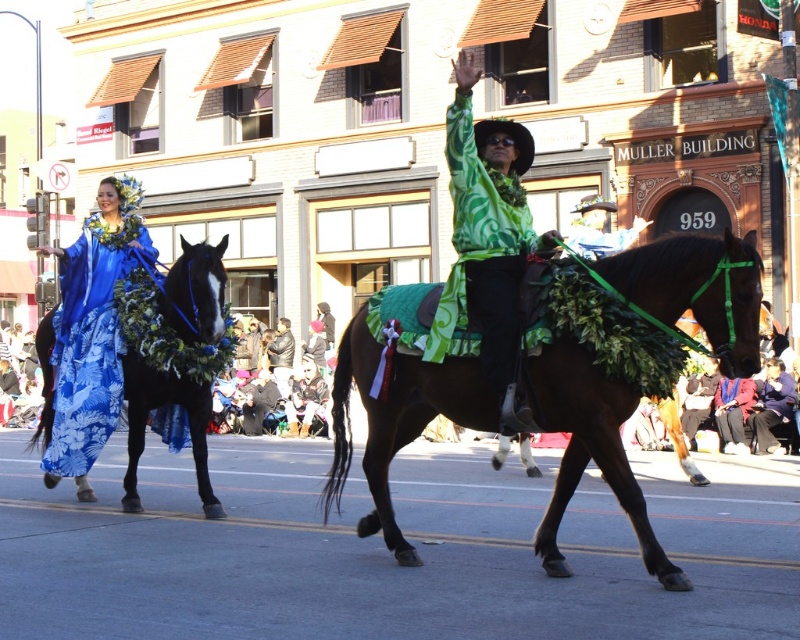
You are a photographer trying to capture a group photo of the green satin shirt at center and the shiny blue fabric horse at left. You want to ensure both subjects are fully visible in the frame. Given their sizes, which subject should you focus on to avoid cropping either of them?

The green satin shirt at center is narrower than the shiny blue fabric horse at left. To avoid cropping either subject, focus on framing the wider shiny blue fabric horse at left first, then adjust the shot to include the narrower green satin shirt at center.

You are a photographer standing in the middle of the parade route. You want to take a photo of the green fabric horse at center and the black leather jacket at center so that both are clearly visible. Considering their sizes, which object should you focus on to ensure both are in frame?

The green fabric horse at center is much taller than the black leather jacket at center. To ensure both are in frame, focus on the green fabric horse at center since it is taller and will require a wider angle to capture its full height, thereby including the smaller black leather jacket at center in the shot.